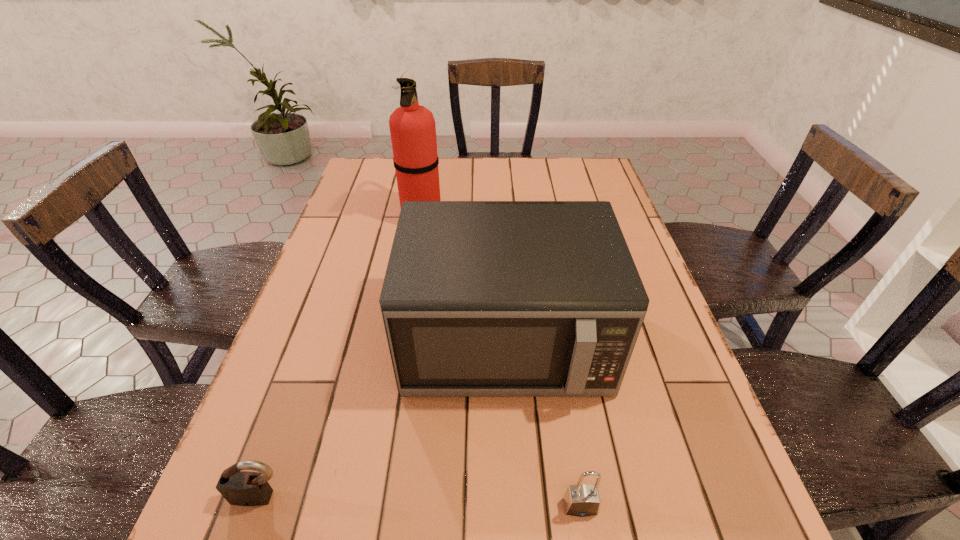
You are a GUI agent. You are given a task and a screenshot of the screen. Output one action in this format:
    pyautogui.click(x=<x>, y=<y>)
    Task: Click on the farthest object
    
    Given the screenshot: What is the action you would take?
    pyautogui.click(x=412, y=127)

I want to click on fire extinguisher, so click(412, 127).

Find the location of a particular element. Image resolution: width=960 pixels, height=540 pixels. the third shortest object is located at coordinates (480, 298).

I want to click on microwave oven, so click(480, 298).

Find the location of `the leftmost object`. the leftmost object is located at coordinates (242, 488).

Image resolution: width=960 pixels, height=540 pixels. I want to click on the right padlock, so 581,500.

You are a GUI agent. You are given a task and a screenshot of the screen. Output one action in this format:
    pyautogui.click(x=<x>, y=<y>)
    Task: Click on the free space located 0.180m at the nozzle of the farthest object
    The height and width of the screenshot is (540, 960).
    Given the screenshot: What is the action you would take?
    pyautogui.click(x=503, y=218)

Where is `free space located on the front-facing side of the third nearest object`? Image resolution: width=960 pixels, height=540 pixels. free space located on the front-facing side of the third nearest object is located at coordinates (511, 436).

Locate an element on the screen. object positioned at the left edge is located at coordinates (242, 488).

Locate an element on the screen. The height and width of the screenshot is (540, 960). object located in the right edge section of the desktop is located at coordinates (480, 298).